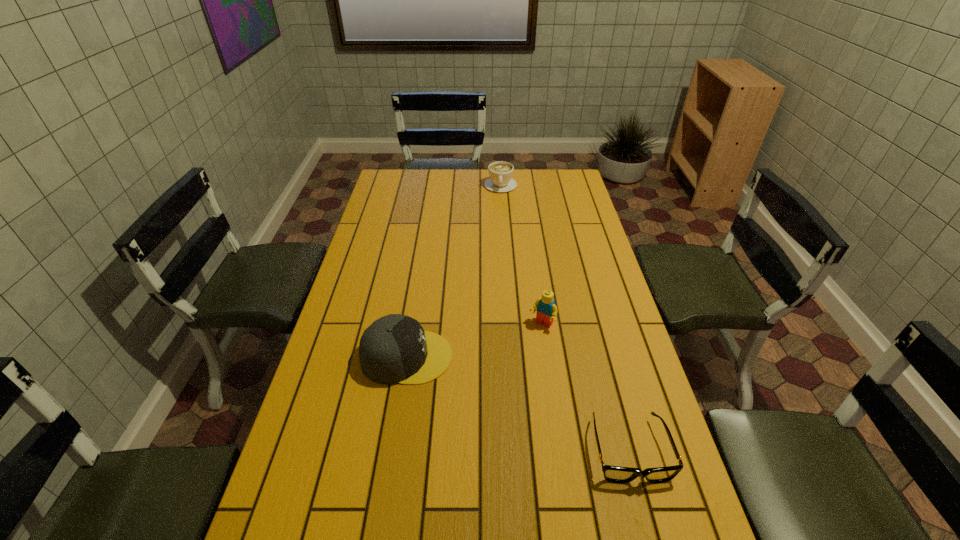
Find the location of `the leftmost object`. the leftmost object is located at coordinates (394, 349).

I want to click on the nearest object, so click(x=615, y=474).

This screenshot has height=540, width=960. Identify the location of the shortest object. (615, 474).

Identify the location of Lego. (546, 309).

Image resolution: width=960 pixels, height=540 pixels. Find the location of `the farthest object`. the farthest object is located at coordinates coord(500,172).

Identify the location of the third tallest object. This screenshot has width=960, height=540. (500, 172).

The height and width of the screenshot is (540, 960). In order to click on free space located on the front-facing side of the cap in this screenshot , I will do `click(567, 357)`.

The width and height of the screenshot is (960, 540). I want to click on free space located 0.080m on the front-facing side of the nearest object, so click(x=649, y=525).

Where is `vacant area situated on the front-facing side of the Lego`? The width and height of the screenshot is (960, 540). vacant area situated on the front-facing side of the Lego is located at coordinates (476, 414).

Locate an element on the screen. This screenshot has height=540, width=960. free space located 0.330m on the front-facing side of the Lego is located at coordinates (476, 414).